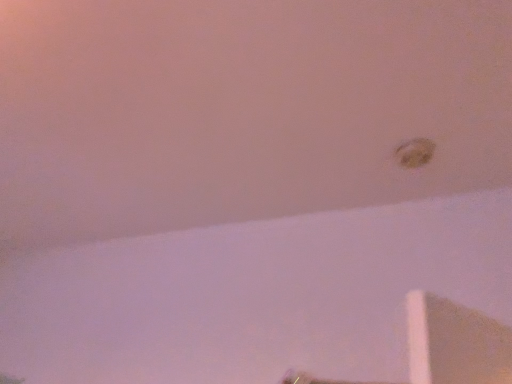
Find the location of a particular element. The width and height of the screenshot is (512, 384). shiny gold coin at upper right is located at coordinates (414, 153).

Describe the element at coordinates (414, 153) in the screenshot. I see `shiny gold coin at upper right` at that location.

I want to click on shiny gold coin at upper right, so click(414, 153).